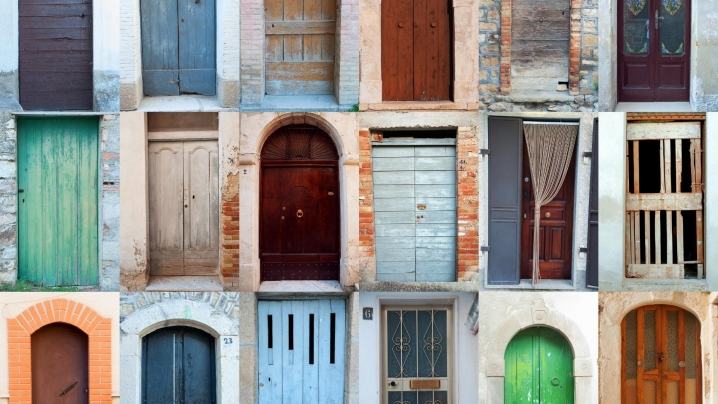
Image resolution: width=718 pixels, height=404 pixels. I want to click on doors with numbers, so click(225, 340), click(365, 315), click(465, 162), click(245, 172).